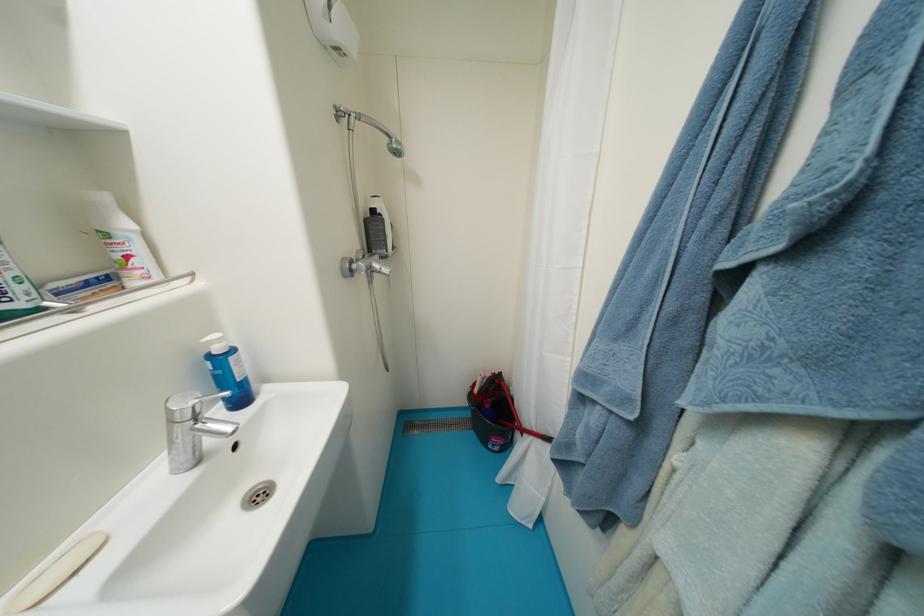
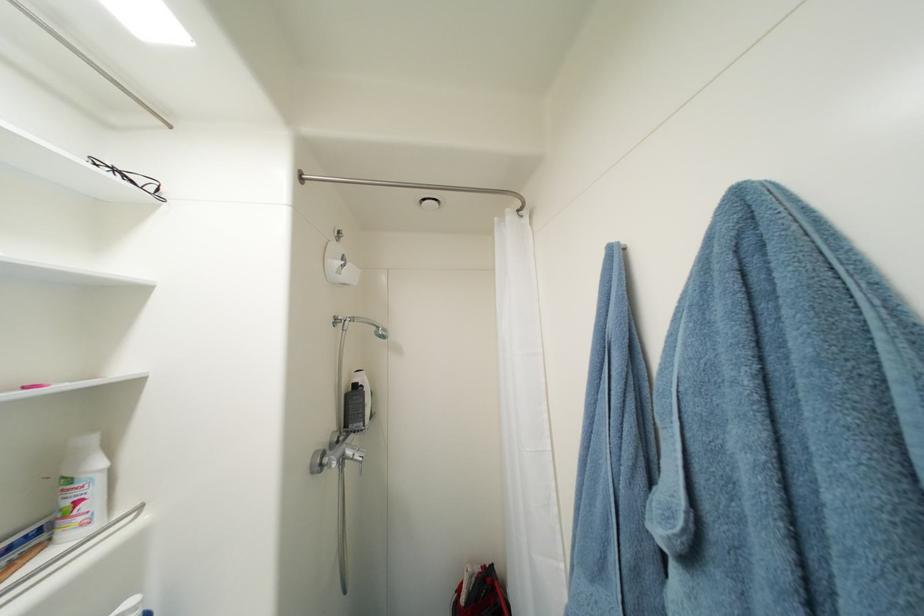
The point at (380,214) is marked in the first image. Where is the corresponding point in the second image?

(361, 387)